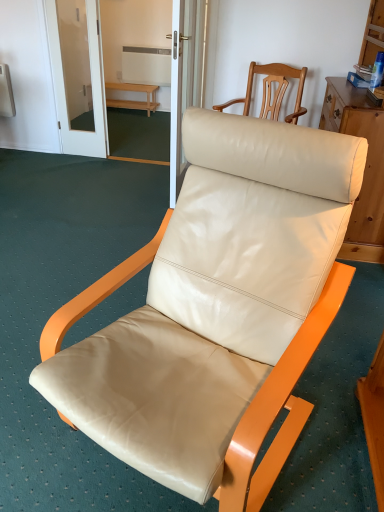
Question: Which direction should I rotate to look at beige leather chair at center, which is the second chair in back-to-front order?

Choices:
 (A) right
 (B) left

Answer: (A)

Question: Are beige leather chair at upper right, positioned as the 1th chair in top-to-bottom order, and light wood bench at center located far from each other?

Choices:
 (A) no
 (B) yes

Answer: (B)

Question: Can you confirm if beige leather chair at upper right, positioned as the 1th chair in top-to-bottom order, is shorter than light wood bench at center?

Choices:
 (A) yes
 (B) no

Answer: (B)

Question: From the image's perspective, would you say beige leather chair at upper right, arranged as the 2th chair when ordered from the bottom, is shown under light wood bench at center?

Choices:
 (A) yes
 (B) no

Answer: (A)

Question: Is beige leather chair at upper right, which is counted as the 1th chair, starting from the back, completely or partially outside of light wood bench at center?

Choices:
 (A) yes
 (B) no

Answer: (A)

Question: From a real-world perspective, is beige leather chair at upper right, arranged as the 2th chair when ordered from the bottom, under light wood bench at center?

Choices:
 (A) yes
 (B) no

Answer: (B)

Question: Is beige leather chair at upper right, which is counted as the 1th chair, starting from the back, aimed at light wood bench at center?

Choices:
 (A) yes
 (B) no

Answer: (B)

Question: Is beige leather chair at center, the 1th chair from the front, smaller than beige leather chair at upper right, the second chair positioned from the front?

Choices:
 (A) yes
 (B) no

Answer: (B)

Question: Considering the relative sizes of beige leather chair at center, the first chair in the bottom-to-top sequence, and beige leather chair at upper right, arranged as the 2th chair when ordered from the bottom, in the image provided, is beige leather chair at center, the first chair in the bottom-to-top sequence, shorter than beige leather chair at upper right, arranged as the 2th chair when ordered from the bottom,?

Choices:
 (A) no
 (B) yes

Answer: (A)

Question: Can we say beige leather chair at center, which is the second chair in back-to-front order, lies outside beige leather chair at upper right, which is counted as the 1th chair, starting from the back?

Choices:
 (A) no
 (B) yes

Answer: (B)

Question: From a real-world perspective, is beige leather chair at center, the first chair in the bottom-to-top sequence, on beige leather chair at upper right, which is counted as the 1th chair, starting from the back?

Choices:
 (A) no
 (B) yes

Answer: (A)

Question: Considering the relative positions of beige leather chair at center, the first chair in the bottom-to-top sequence, and beige leather chair at upper right, positioned as the 1th chair in top-to-bottom order, in the image provided, is beige leather chair at center, the first chair in the bottom-to-top sequence, to the left of beige leather chair at upper right, positioned as the 1th chair in top-to-bottom order, from the viewer's perspective?

Choices:
 (A) yes
 (B) no

Answer: (A)

Question: Can you confirm if beige leather chair at center, the 1th chair from the front, is taller than beige leather chair at upper right, the second chair positioned from the front?

Choices:
 (A) no
 (B) yes

Answer: (B)

Question: Is light wood bench at center positioned behind beige leather chair at center, which is the second chair in back-to-front order?

Choices:
 (A) no
 (B) yes

Answer: (B)